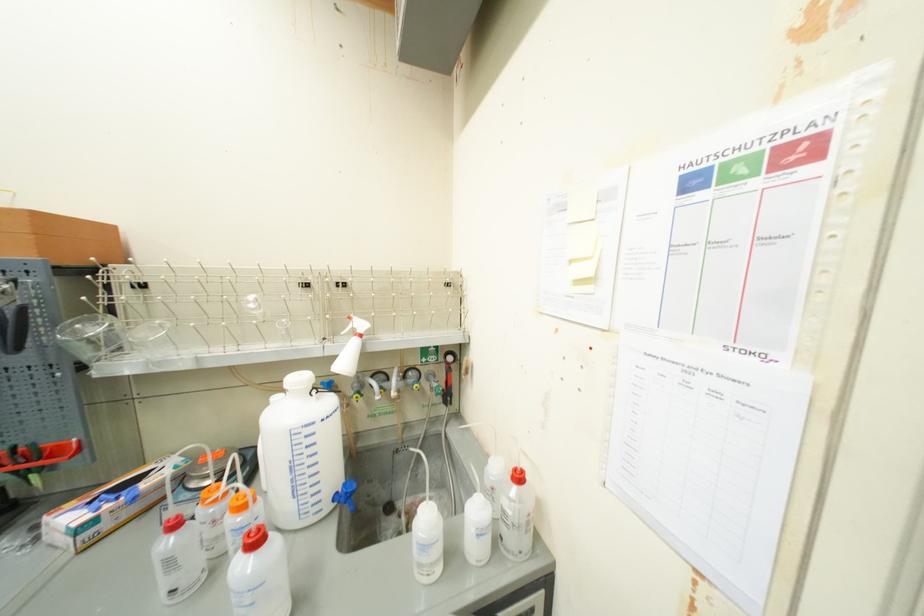
Image resolution: width=924 pixels, height=616 pixels. I want to click on red shower handle, so click(35, 459).